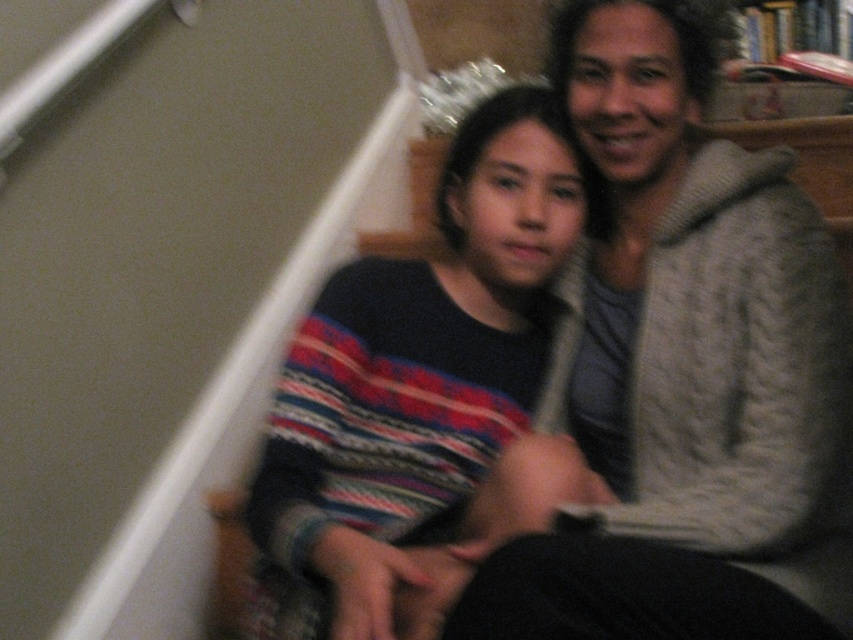
You are a photographer trying to focus on the knitted gray sweater at upper right and the striped sweater at center. Which sweater should you adjust your camera to prioritize focusing on first if you want to ensure both are in focus?

You should prioritize focusing on the knitted gray sweater at upper right first because it is closer to the camera than the striped sweater at center, so adjusting focus starting from the closer one ensures both can be in focus.

You are a photographer standing 5 feet away from the two people. You want to take a photo of them both clearly. Given that your camera has a maximum focus range of 5 feet, will both the point at (732,449) and the other person be in focus?

Result: Both the point at (732,449) and the other person are within the 5 feet focus range since they are only 3.34 feet apart from each other, so the camera can focus on both.